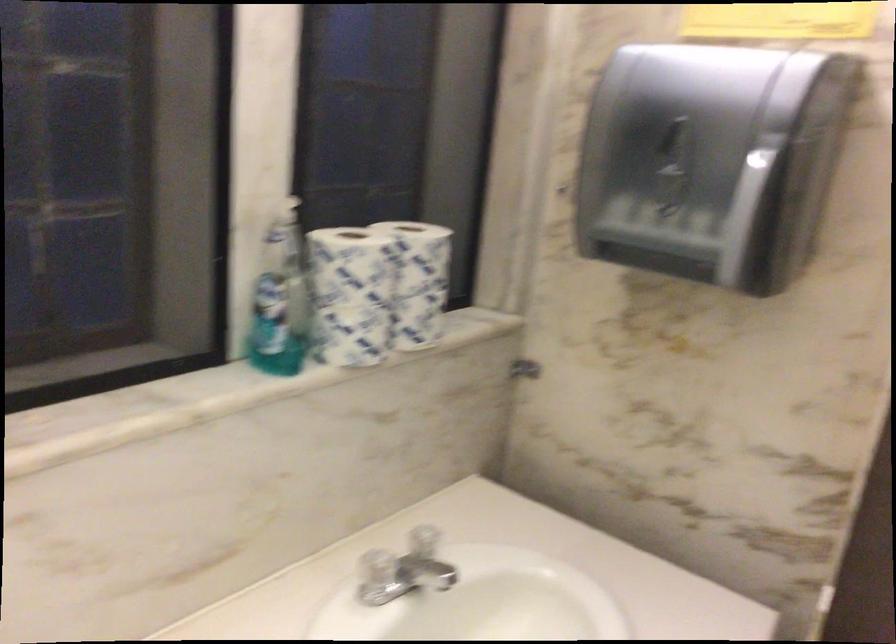
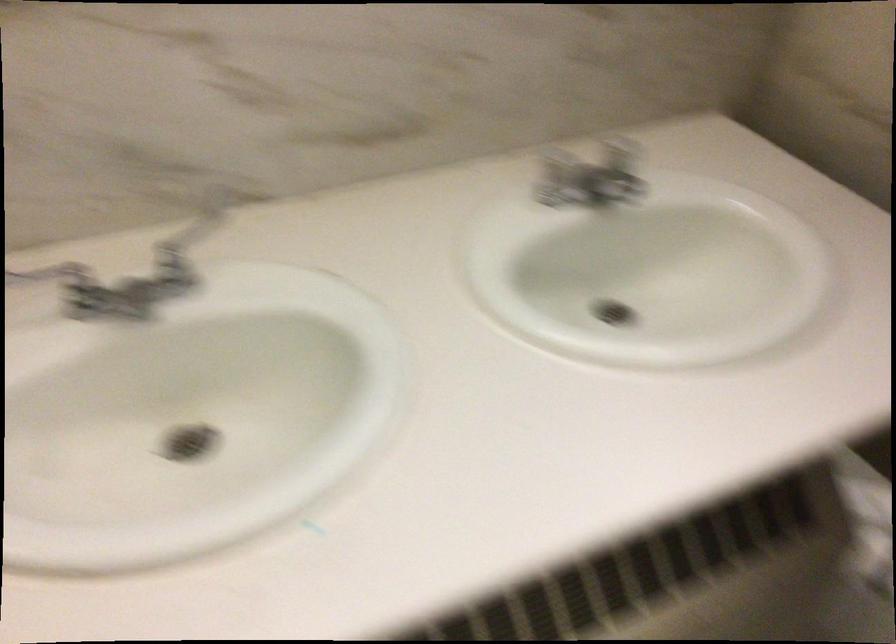
The point at (440,536) is marked in the first image. Where is the corresponding point in the second image?

(622, 147)